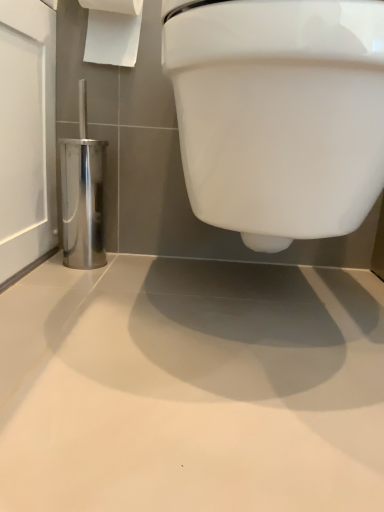
Question: Considering the positions of white glossy toilet at upper center and polished metallic toilet brush holder at left in the image, is white glossy toilet at upper center taller or shorter than polished metallic toilet brush holder at left?

Choices:
 (A) tall
 (B) short

Answer: (A)

Question: Is point (274, 79) positioned closer to the camera than point (69, 143)?

Choices:
 (A) closer
 (B) farther

Answer: (A)

Question: Estimate the real-world distances between objects in this image. Which object is farther from the polished metallic toilet brush holder at left?

Choices:
 (A) white paper at upper left
 (B) white glossy toilet at upper center

Answer: (B)

Question: Which is farther from the polished metallic toilet brush holder at left?

Choices:
 (A) white paper at upper left
 (B) white glossy toilet at upper center

Answer: (B)